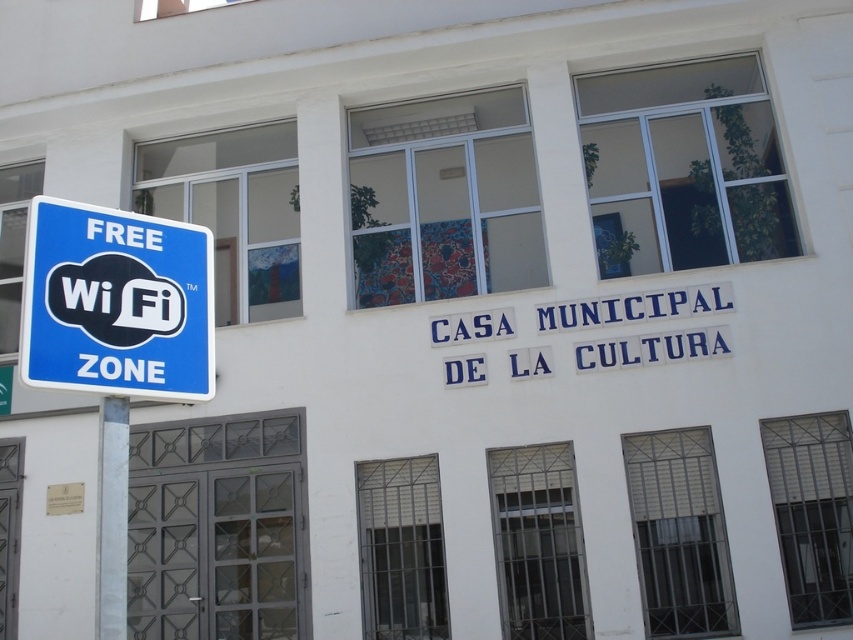
You are standing in front of the building and want to place a small potted plant between the blue plastic sign at left and the white marble pole at left. Based on their widths, can the plant fit between them?

The blue plastic sign at left might be wider than white marble pole at left, so there might be enough space for the small potted plant between them depending on their exact widths.

You are standing in front of the building and want to take a photo of the white marble pole at left without the blue plastic sign at left blocking the view. Is it possible to do so by moving to the side?

The blue plastic sign at left is further to the viewer than the white marble pole at left, so moving to the side might allow you to position yourself where the blue plastic sign at left is no longer blocking the white marble pole at left.